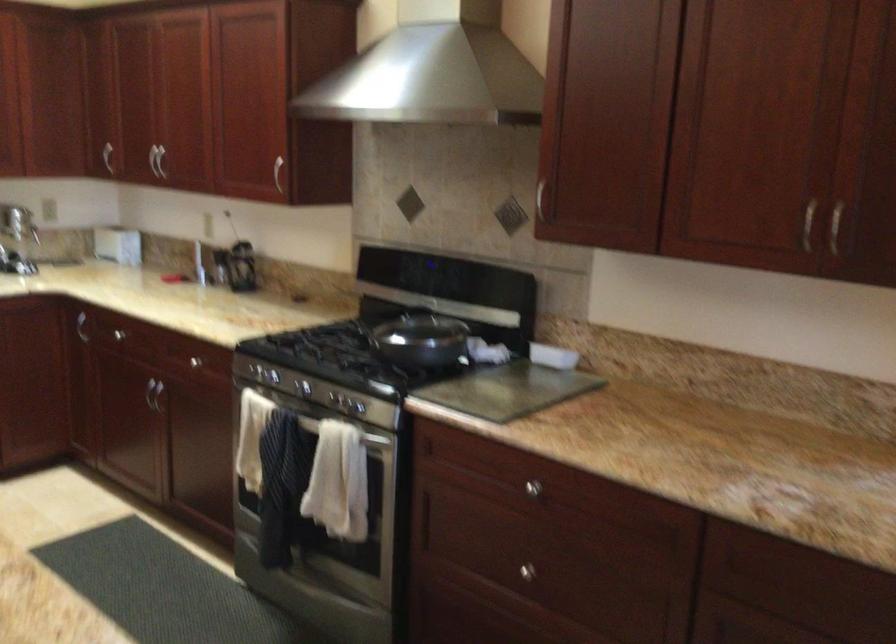
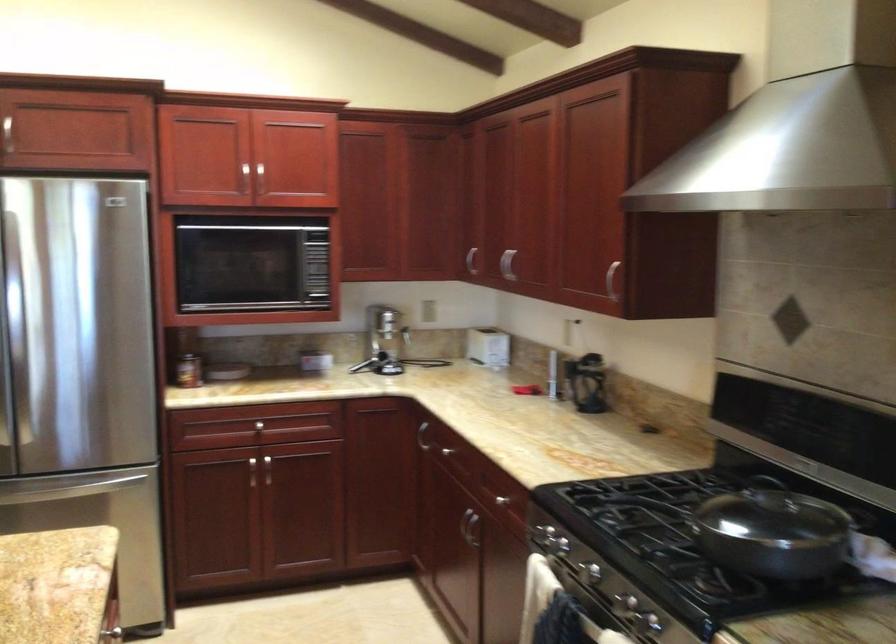
Find the pixel in the second image that matches the point at 273,167 in the first image.

(612, 279)